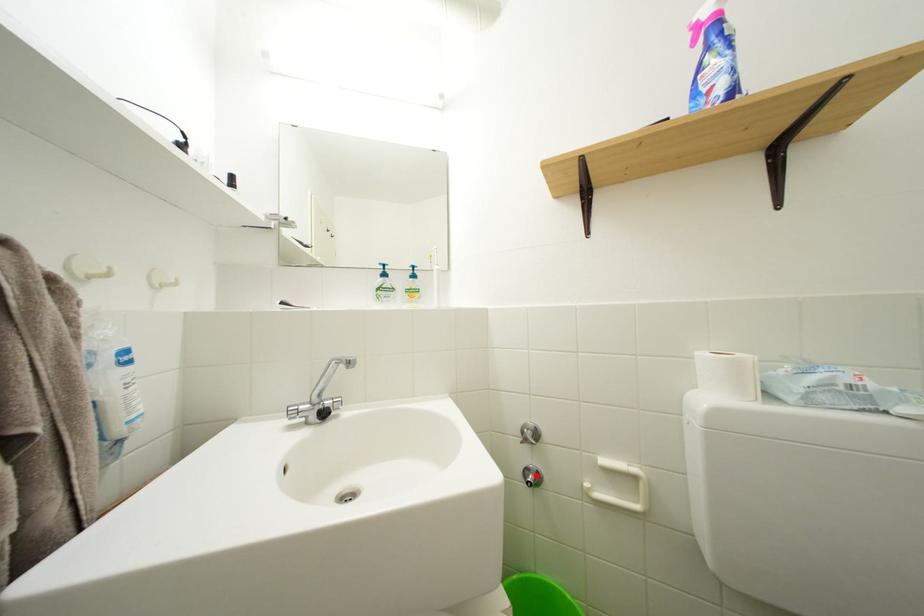
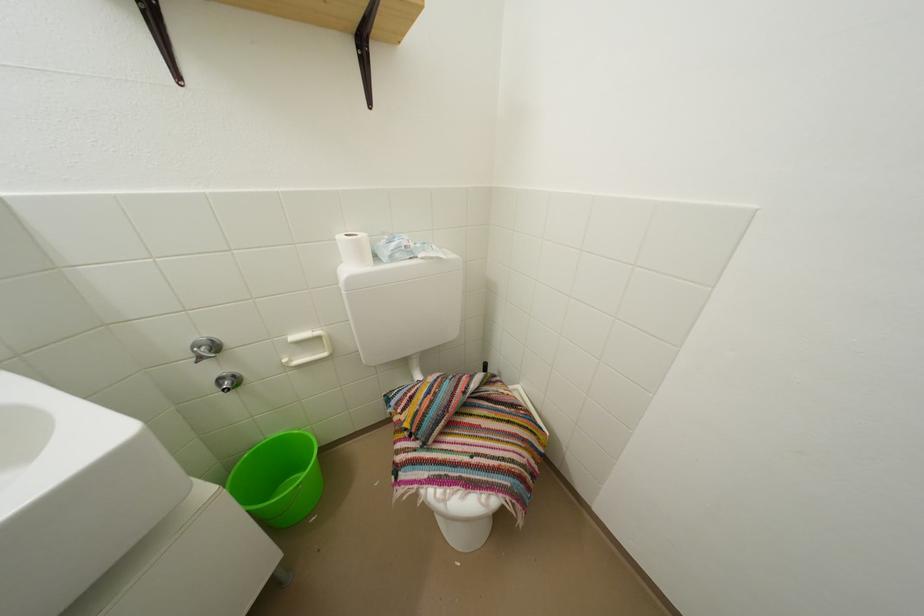
Locate, in the second image, the point that corresponds to the highlighted location in the first image.

(229, 386)